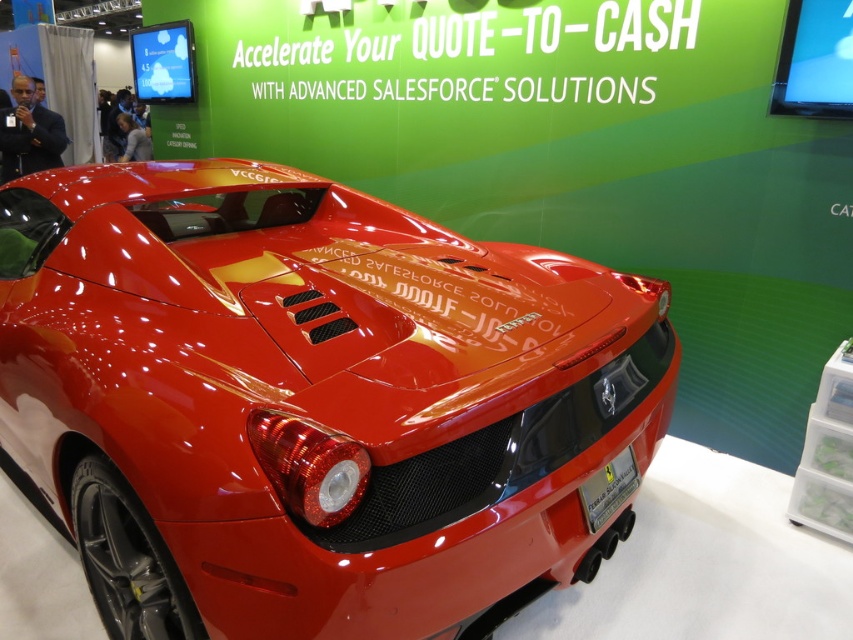
Question: Which point is closer to the camera taking this photo?

Choices:
 (A) (166, 200)
 (B) (614, 493)

Answer: (B)

Question: Which object is closer to the camera taking this photo?

Choices:
 (A) glossy red sports car at center
 (B) metallic silver license plate at center

Answer: (A)

Question: Which point appears closest to the camera in this image?

Choices:
 (A) (602, 474)
 (B) (509, 515)

Answer: (B)

Question: Is glossy red sports car at center positioned in front of metallic silver license plate at center?

Choices:
 (A) no
 (B) yes

Answer: (B)

Question: Where is glossy red sports car at center located in relation to metallic silver license plate at center in the image?

Choices:
 (A) above
 (B) below

Answer: (A)

Question: Can you confirm if glossy red sports car at center is positioned to the right of metallic silver license plate at center?

Choices:
 (A) yes
 (B) no

Answer: (B)